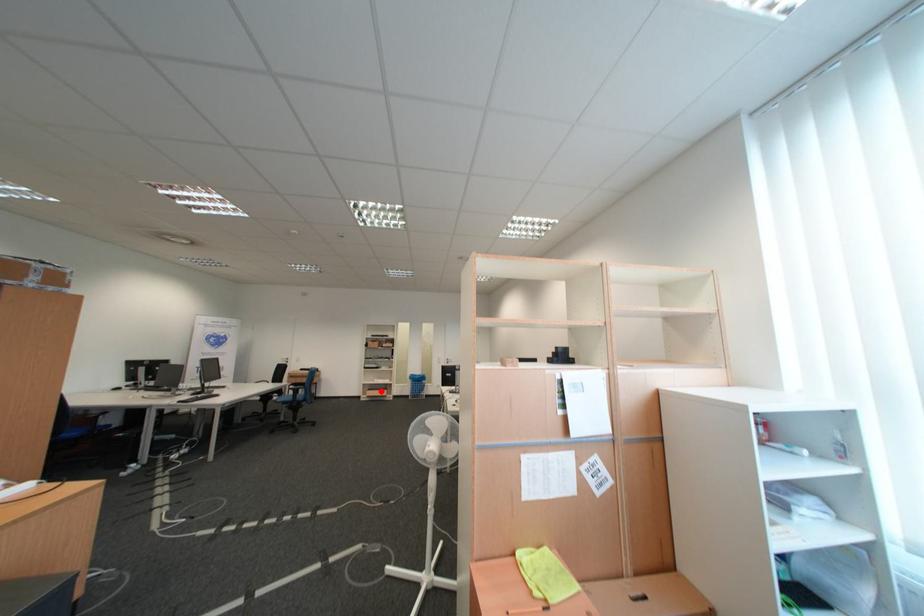
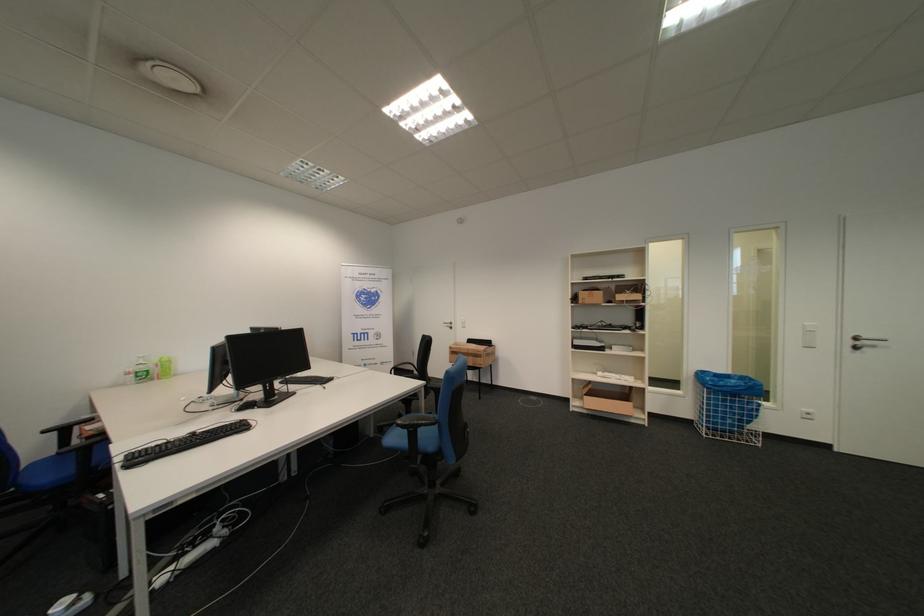
Where in the second image is the point corresponding to the highlighted location from the first image?

(601, 395)